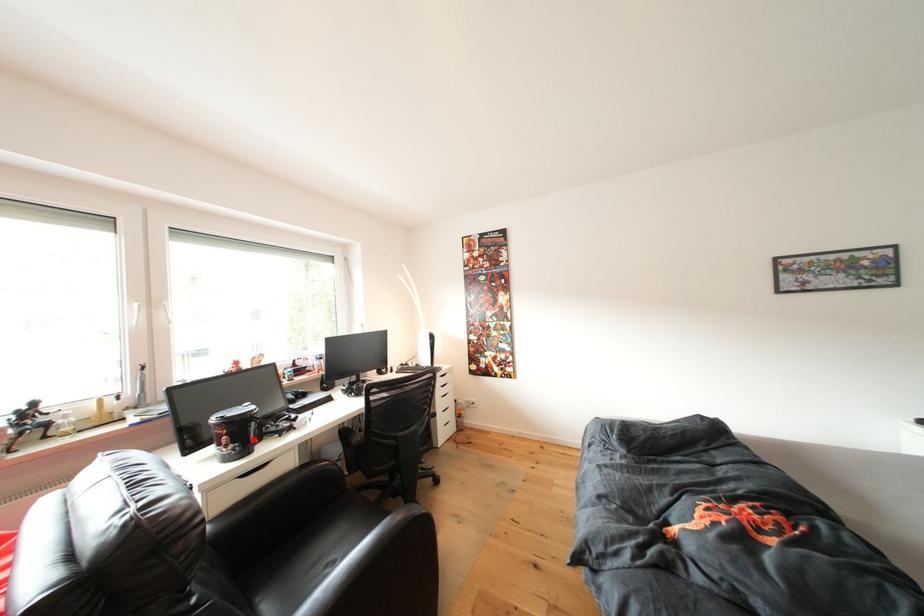
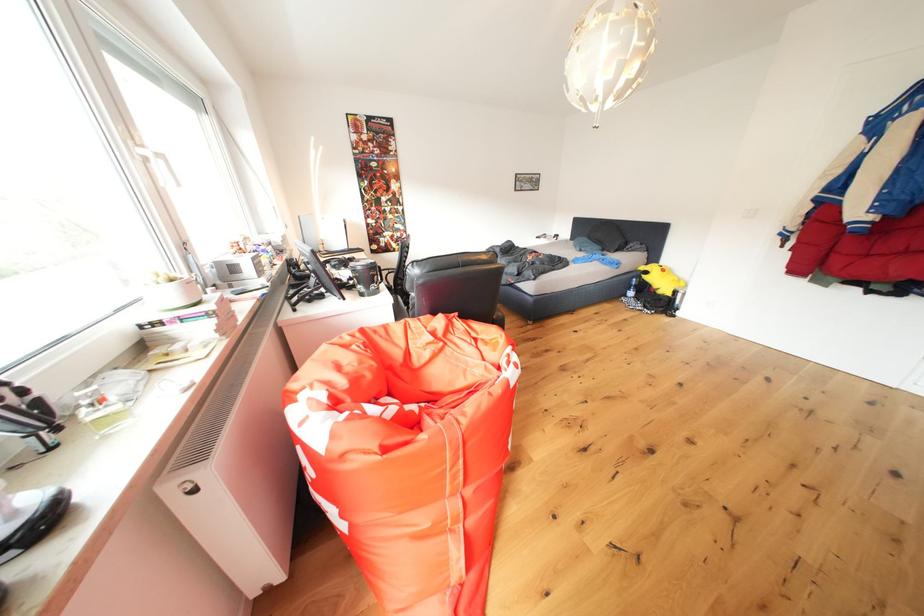
Question: I am providing you with two images of the same scene from different viewpoints. A red point is marked on the first image. At the location where the point appears in image 1, is it still visible in image 2?

Choices:
 (A) Yes
 (B) No

Answer: (B)